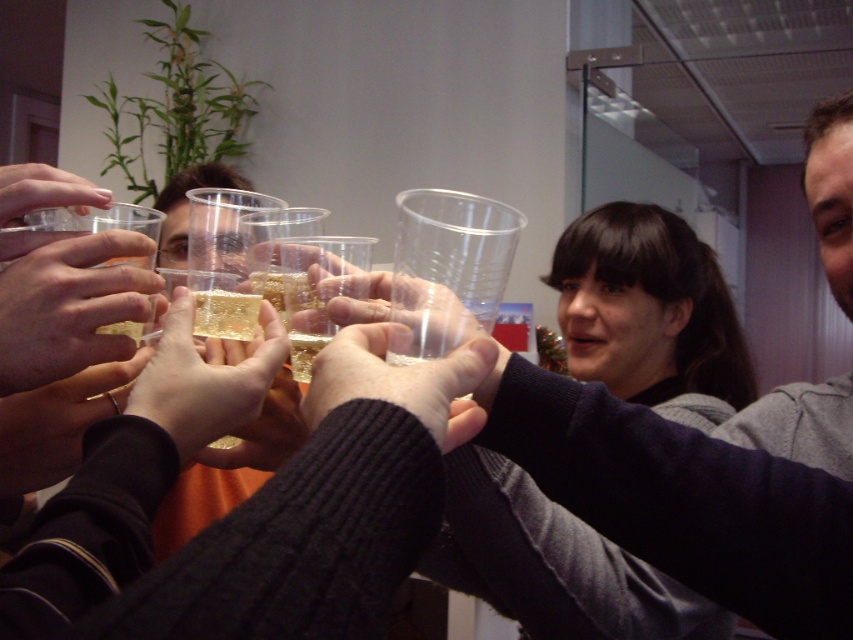
You are an interior designer assessing the placement of a new matte gold ring at center in an office space. The ring is positioned at coordinates point (68, 307). Based on the scene description, which object in the image is closest to the matte gold ring at center?

The matte gold ring at center is closest to the glass partition because the coordinates point (68, 307) places it near the glass partition mentioned in the scene description.

Based on the photo, you are a guest at a party and want to place a matte gold ring at center on top of the translucent plastic block at center. Can you do that based on their positions?

The matte gold ring at center is positioned on the left side of the translucent plastic block at center, so you can place the matte gold ring at center on top of the translucent plastic block at center since they are aligned horizontally.

Consider the image. You are at a company event and want to take a photo of the matte gold ring at center and the transparent plastic cup at upper left. Which object should you focus on first if you want to capture both in the same frame without moving the camera?

The matte gold ring at center is located below the transparent plastic cup at upper left, so you should focus on the transparent plastic cup at upper left first to ensure both are in the frame.